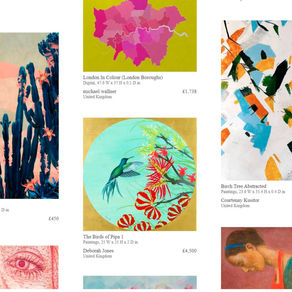
Where is `arartwork / paintingtwork / painting`? The image size is (292, 292). arartwork / paintingtwork / painting is located at coordinates (33, 148), (130, 211).